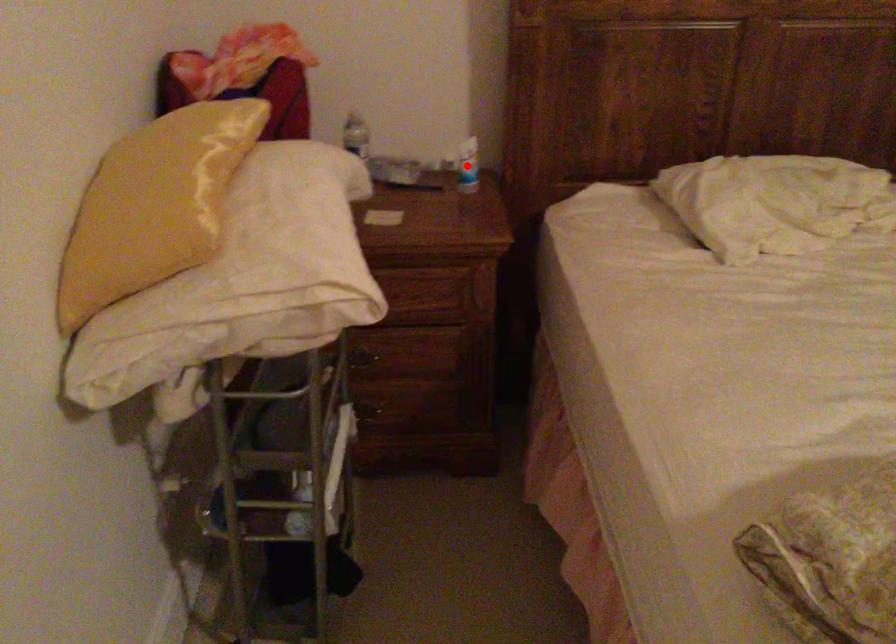
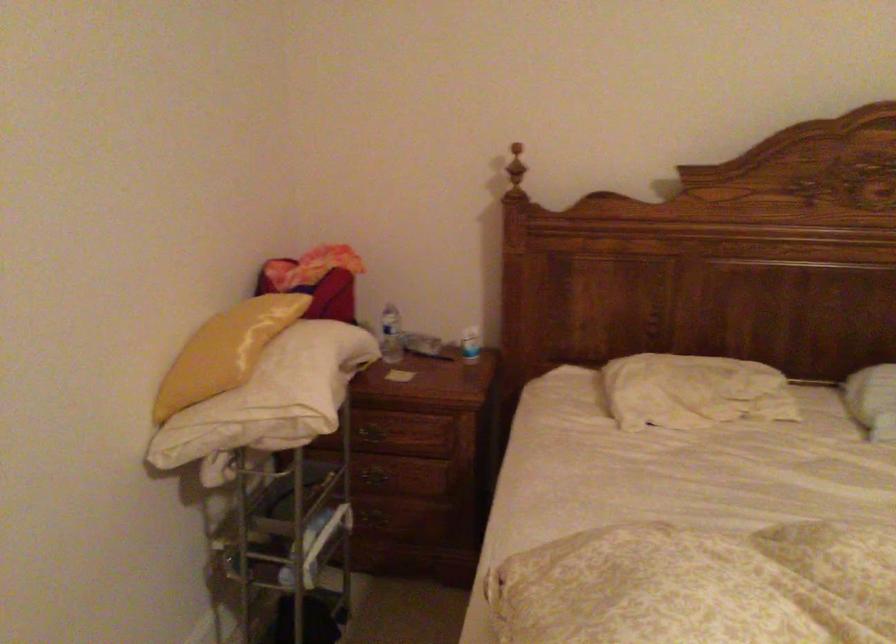
Question: I am providing you with two images of the same scene from different viewpoints. In image1, a red point is highlighted. Considering the same 3D point in image2, which of the following is correct?

Choices:
 (A) It is closer
 (B) It is farther

Answer: (B)